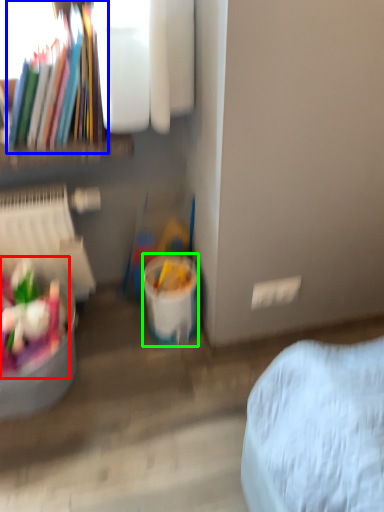
Question: Based on their relative distances, which object is nearer to food (highlighted by a red box)? Choose from book (highlighted by a blue box) and bucket (highlighted by a green box).

Choices:
 (A) book
 (B) bucket

Answer: (B)